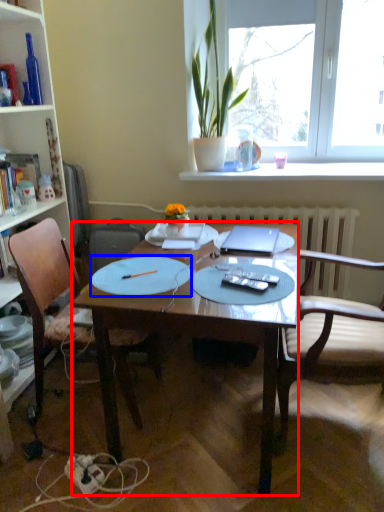
Question: Which object is closer to the camera taking this photo, desk (highlighted by a red box) or paper plate (highlighted by a blue box)?

Choices:
 (A) desk
 (B) paper plate

Answer: (A)